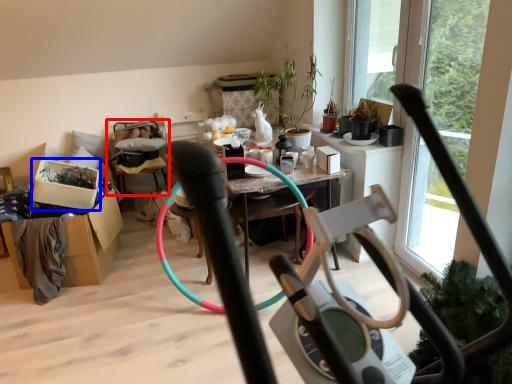
Question: Which object appears closest to the camera in this image, armchair (highlighted by a red box) or box (highlighted by a blue box)?

Choices:
 (A) armchair
 (B) box

Answer: (B)